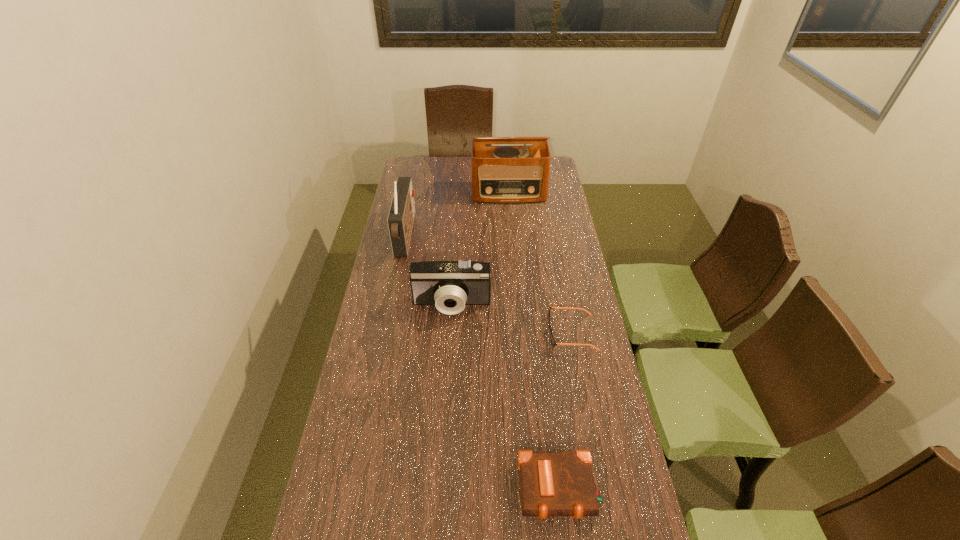
What are the coordinates of `vacant region located on the lens of the camcorder` in the screenshot? It's located at (450, 334).

Where is `vacant space located 0.090m on the front-facing side of the shortest object`? The height and width of the screenshot is (540, 960). vacant space located 0.090m on the front-facing side of the shortest object is located at coordinates (521, 333).

Find the location of `blank space located 0.130m on the front-facing side of the shortest object`. blank space located 0.130m on the front-facing side of the shortest object is located at coordinates (510, 333).

The image size is (960, 540). I want to click on vacant space located 0.270m on the front-facing side of the shortest object, so click(469, 333).

This screenshot has height=540, width=960. I want to click on radio receiver present at the left edge, so click(401, 215).

Where is `camcorder located at the left edge`? The height and width of the screenshot is (540, 960). camcorder located at the left edge is located at coordinates (449, 285).

Image resolution: width=960 pixels, height=540 pixels. Identify the location of radio receiver located at the right edge. (500, 174).

At what (x,y) coordinates should I click in order to perform the action: click on Bible that is at the right edge. Please return your answer as a coordinate pair (x, y). The height and width of the screenshot is (540, 960). Looking at the image, I should click on (551, 483).

In order to click on spectacles that is positioned at the right edge in this screenshot , I will do `click(554, 343)`.

Find the location of a particular element. vacant region at the left edge of the desktop is located at coordinates (370, 477).